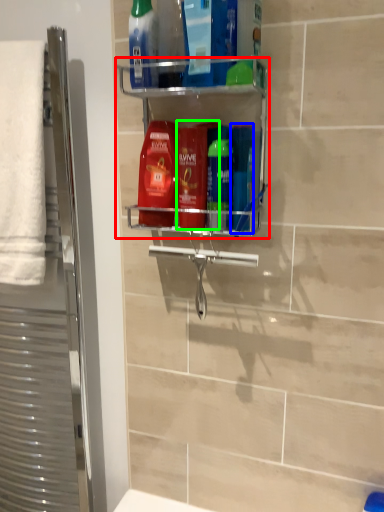
Question: Which object is the farthest from shelf (highlighted by a red box)? Choose among these: mouthwash (highlighted by a blue box) or mouthwash (highlighted by a green box).

Choices:
 (A) mouthwash
 (B) mouthwash

Answer: (A)